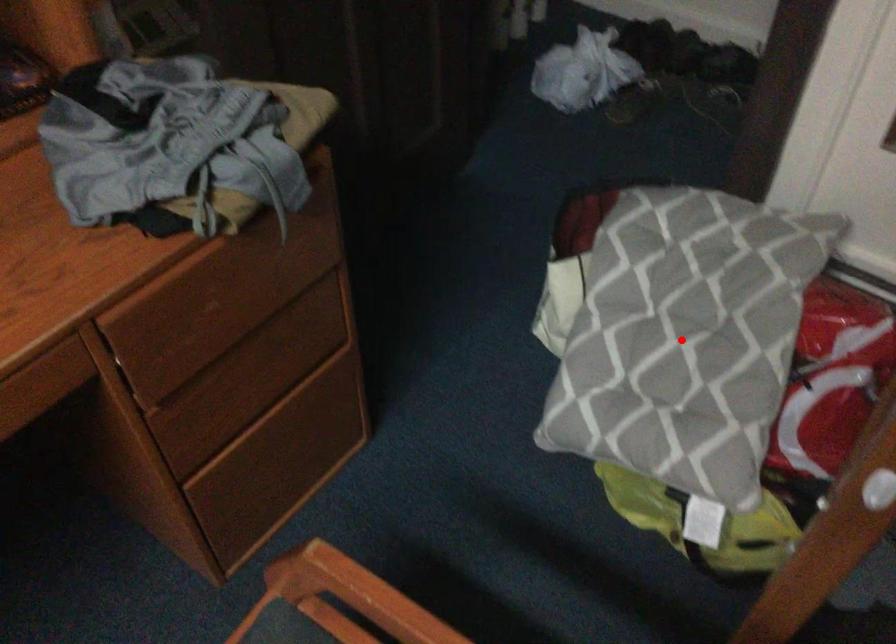
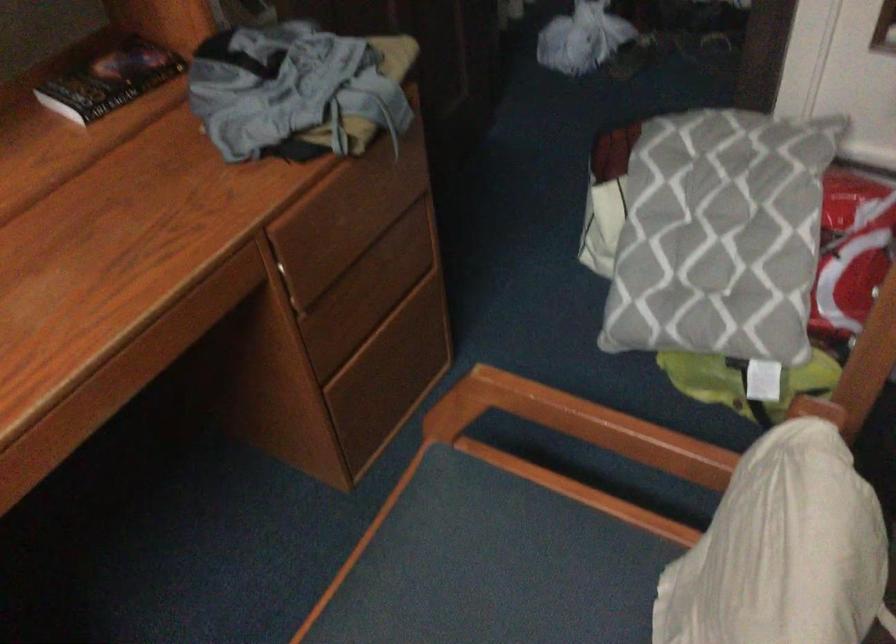
Where in the second image is the point corresponding to the highlighted location from the first image?

(719, 236)